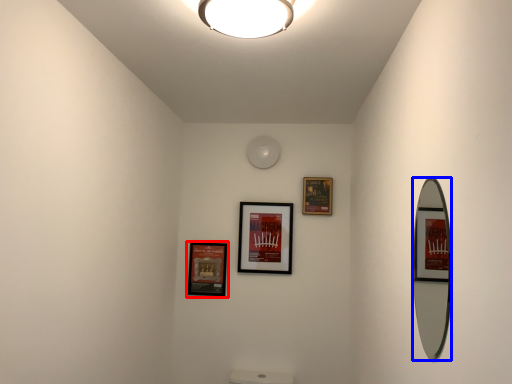
Question: Which of the following is the closest to the observer, picture frame (highlighted by a red box) or mirror (highlighted by a blue box)?

Choices:
 (A) picture frame
 (B) mirror

Answer: (B)